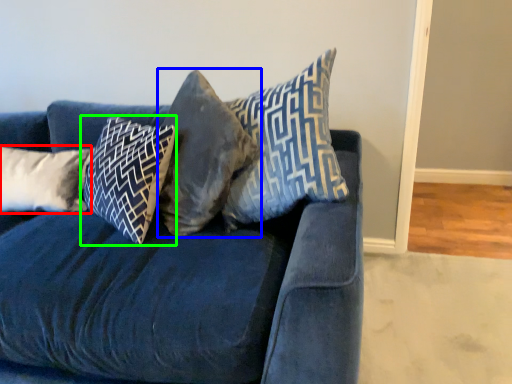
Question: Which object is positioned farthest from pillow (highlighted by a red box)? Select from pillow (highlighted by a blue box) and pillow (highlighted by a green box).

Choices:
 (A) pillow
 (B) pillow

Answer: (A)